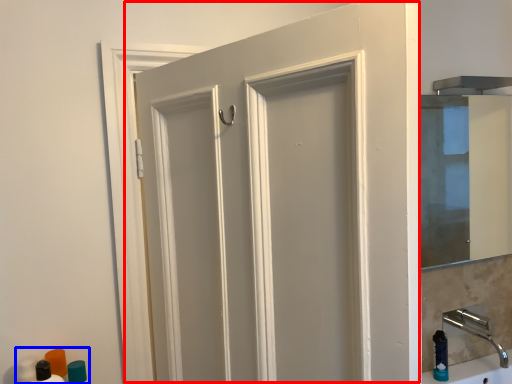
Question: Among these objects, which one is farthest to the camera, door (highlighted by a red box) or toiletry (highlighted by a blue box)?

Choices:
 (A) door
 (B) toiletry

Answer: (B)